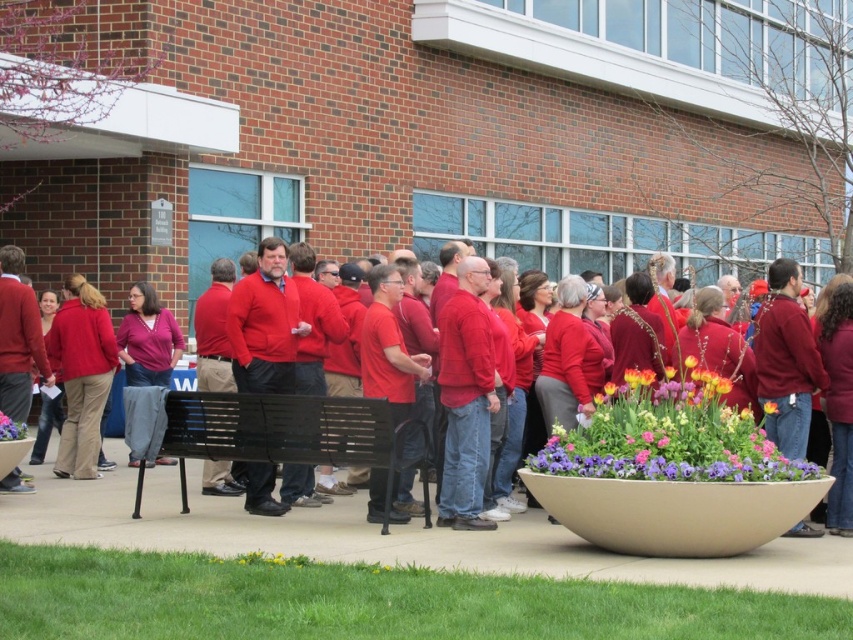
Question: Among these points, which one is farthest from the camera?

Choices:
 (A) (712, 429)
 (B) (775, 404)
 (C) (12, 436)
 (D) (378, 433)

Answer: (C)

Question: Is black metal bench at lower center thinner than yellow matte flower at center?

Choices:
 (A) yes
 (B) no

Answer: (B)

Question: Which point is farther to the camera?

Choices:
 (A) (106, 384)
 (B) (666, 419)
 (C) (767, 406)
 (D) (22, 436)

Answer: (A)

Question: Can you confirm if matte red sweater at center is wider than vibrant floral bouquet at center?

Choices:
 (A) no
 (B) yes

Answer: (B)

Question: Is vibrant floral bouquet at center below purple matte flower at lower center?

Choices:
 (A) yes
 (B) no

Answer: (B)

Question: Which object appears farthest from the camera in this image?

Choices:
 (A) purple matte flower at lower center
 (B) matte red sweater at center
 (C) yellow matte flower at center

Answer: (A)